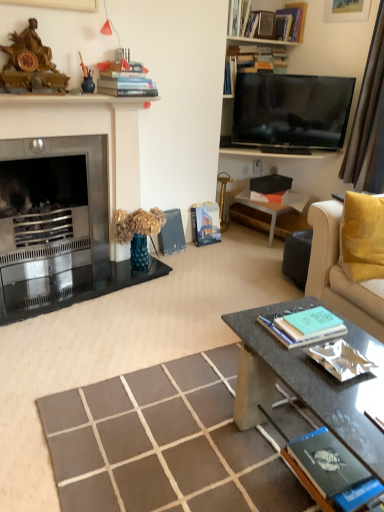
Locate an element on the screen. free space on the front side of shiny metallic book at center-right, which ranks as the 2th book in bottom-to-top order is located at coordinates (346, 402).